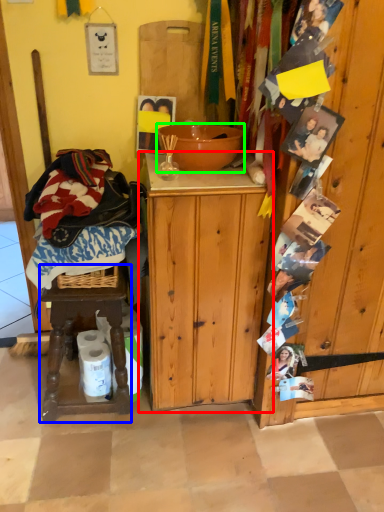
Question: Which object is positioned farthest from cabinetry (highlighted by a red box)? Select from stool (highlighted by a blue box) and bowl (highlighted by a green box).

Choices:
 (A) stool
 (B) bowl

Answer: (B)